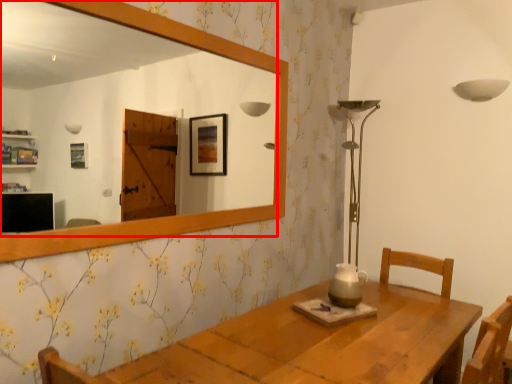
Question: From the image's perspective, what is the correct spatial relationship of mirror (annotated by the red box) in relation to candle holder?

Choices:
 (A) above
 (B) below

Answer: (A)